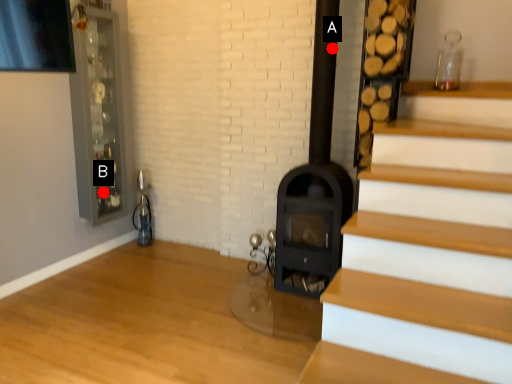
Question: Two points are circled on the image, labeled by A and B beside each circle. Which point appears farthest from the camera in this image?

Choices:
 (A) A is further
 (B) B is further

Answer: (B)